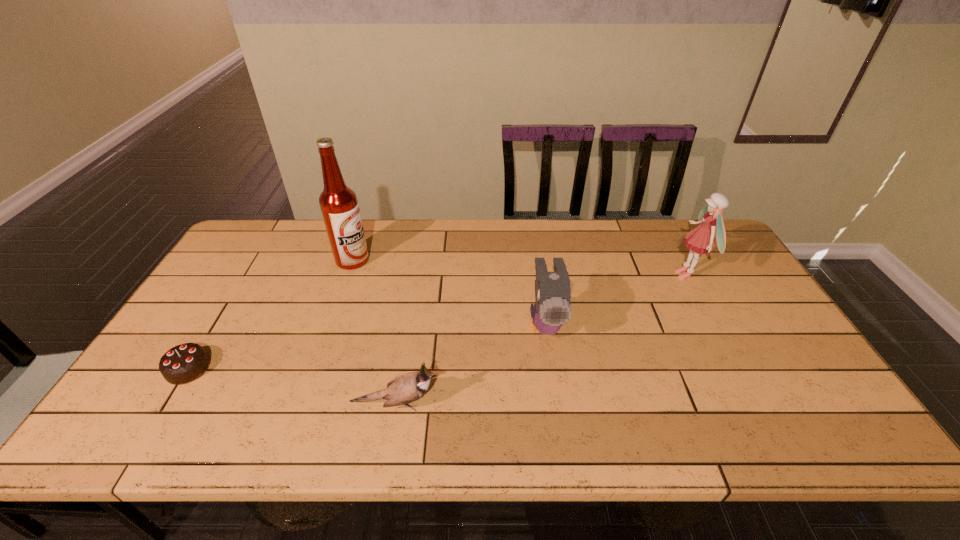
Identify the location of the second object from left to right. This screenshot has width=960, height=540. (339, 205).

I want to click on the tallest object, so click(x=339, y=205).

I want to click on the fourth shortest object, so click(701, 239).

Find the location of a particular element. the rightmost object is located at coordinates (701, 239).

I want to click on the right bird, so click(552, 308).

The image size is (960, 540). What are the coordinates of `the second object from right to left` in the screenshot? It's located at (552, 308).

The height and width of the screenshot is (540, 960). Find the location of `the third object from right to left`. the third object from right to left is located at coordinates (404, 389).

Image resolution: width=960 pixels, height=540 pixels. Identify the location of the second shortest object. (404, 389).

Image resolution: width=960 pixels, height=540 pixels. Find the location of `the shortest object`. the shortest object is located at coordinates point(184,363).

You are a GUI agent. You are given a task and a screenshot of the screen. Output one action in this format:
    pyautogui.click(x=<x>, y=<y>)
    Task: Click on the leftmost object
    
    Given the screenshot: What is the action you would take?
    pyautogui.click(x=184, y=363)